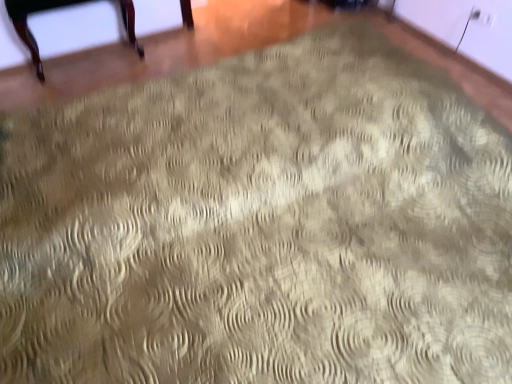
Where is `mahogany wood chair legs at upper left`? This screenshot has height=384, width=512. mahogany wood chair legs at upper left is located at coordinates (27, 23).

The width and height of the screenshot is (512, 384). Describe the element at coordinates (27, 23) in the screenshot. I see `mahogany wood chair legs at upper left` at that location.

Locate an element on the screen. The width and height of the screenshot is (512, 384). mahogany wood chair legs at upper left is located at coordinates (27, 23).